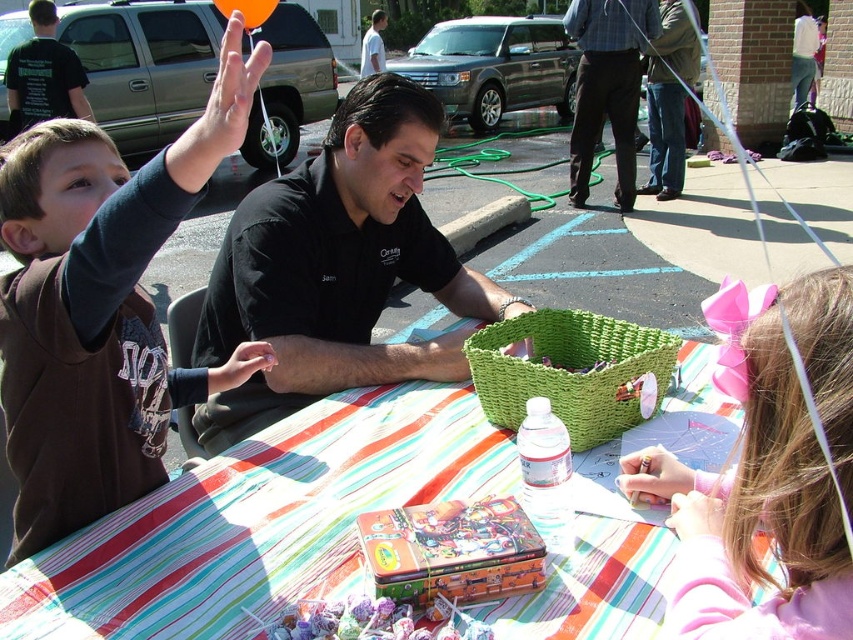
You are a photographer trying to capture a clear shot of the black shirt at center and the brown fleece jacket at left. Based on their heights, which object should you focus on first if you want to ensure both are in frame without adjusting your camera angle?

The brown fleece jacket at left is not as tall as the black shirt at center, so you should focus on the black shirt at center first to ensure both are in frame.

You are a photographer at the event and want to capture the orange matte balloon at upper center and brown cotton pants at center in the same frame. Which object should you position your camera closer to in order to include both in the shot?

To include both the orange matte balloon at upper center and brown cotton pants at center in the shot, position the camera closer to the orange matte balloon at upper center since the brown cotton pants at center is to the right of it, allowing for a wider angle to capture both.

You are a photographer standing at the edge of the scene. You want to take a photo that includes both the brown cotton pants at center and the orange matte balloon at upper center. What is the minimum distance you need to move backward to ensure both objects are in frame?

The brown cotton pants at center and orange matte balloon at upper center are 4.70 meters apart. To include both in the frame, you need to move back at least 4.70 meters to ensure the entire distance between them fits within the camera view.